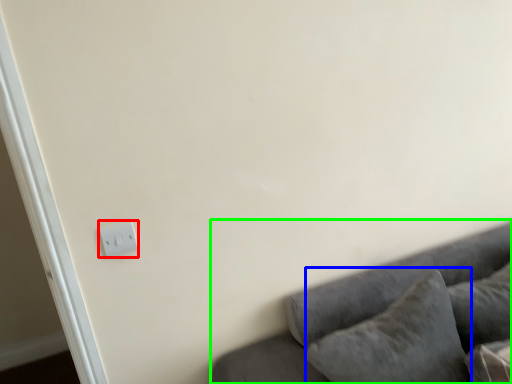
Question: Which is nearer to the light switch (highlighted by a red box)? pillow (highlighted by a blue box) or studio couch (highlighted by a green box).

Choices:
 (A) pillow
 (B) studio couch

Answer: (B)